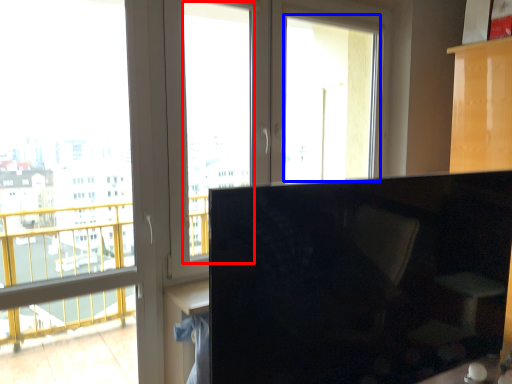
Question: Which object is closer to the camera taking this photo, window screen (highlighted by a red box) or window screen (highlighted by a blue box)?

Choices:
 (A) window screen
 (B) window screen

Answer: (A)